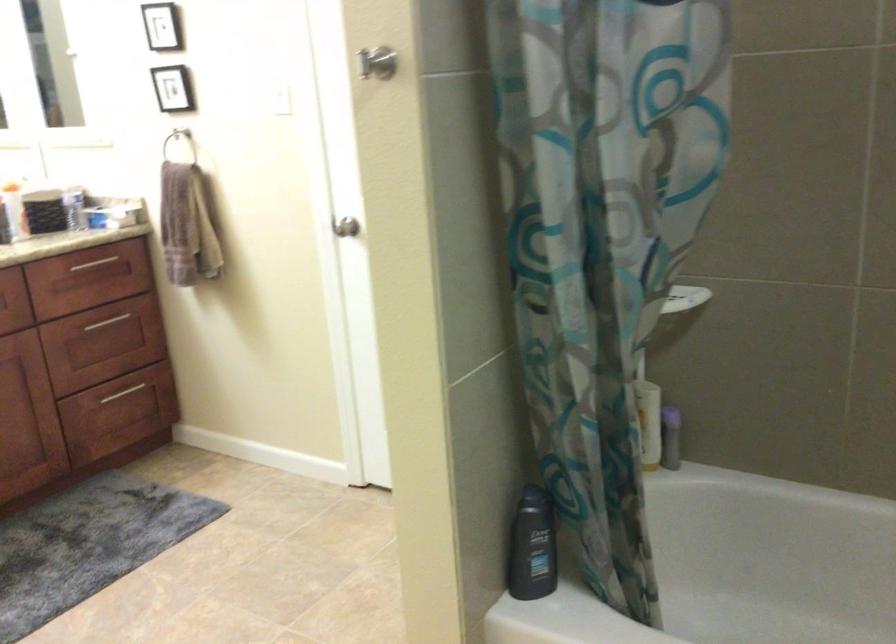
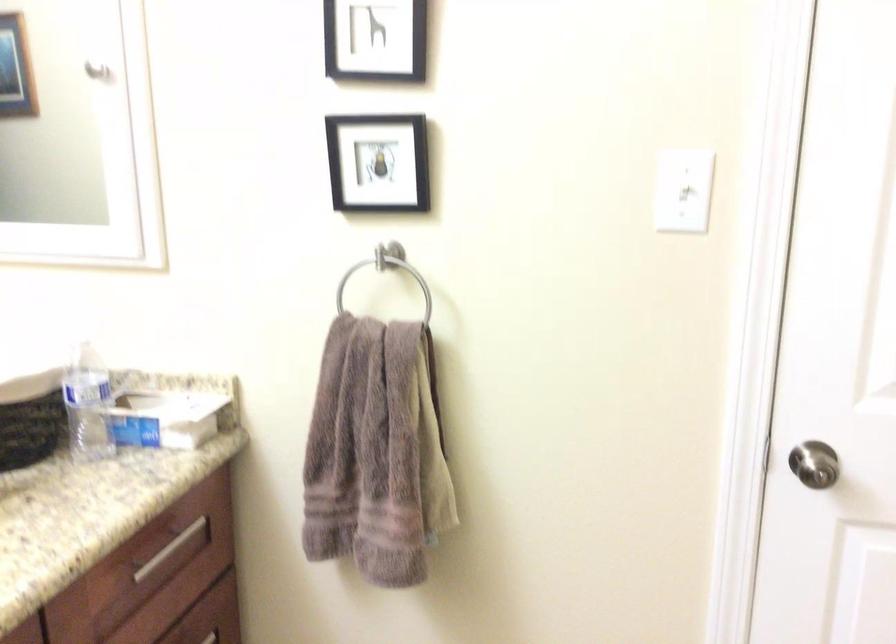
In the second image, find the point that corresponds to (74,198) in the first image.

(88, 404)